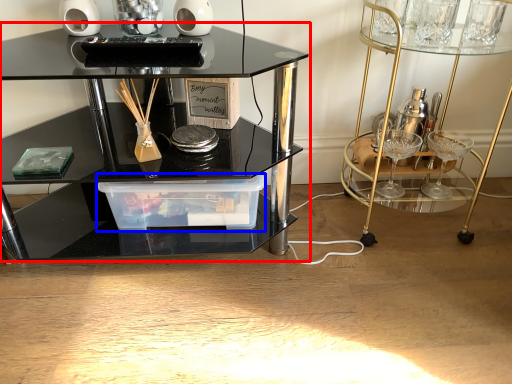
Question: Which object appears farthest to the camera in this image, table (highlighted by a red box) or glass box (highlighted by a blue box)?

Choices:
 (A) table
 (B) glass box

Answer: (B)